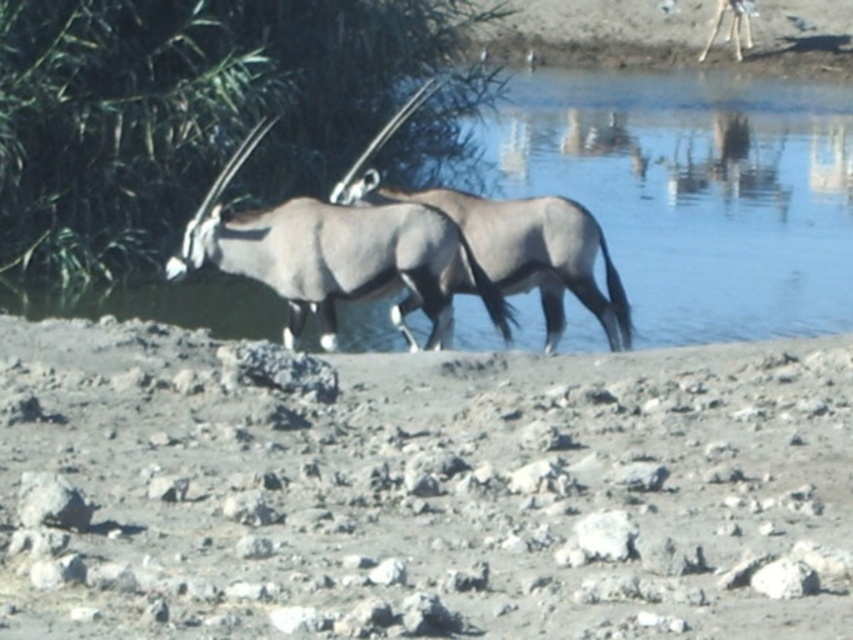
Looking at this image, you are standing at the point marked by the coordinates point (691, 192) in the image. Based on the scene described, what type of terrain or surface are you likely standing on?

The point (691, 192) is on clear blue water at center, so you are standing on water.